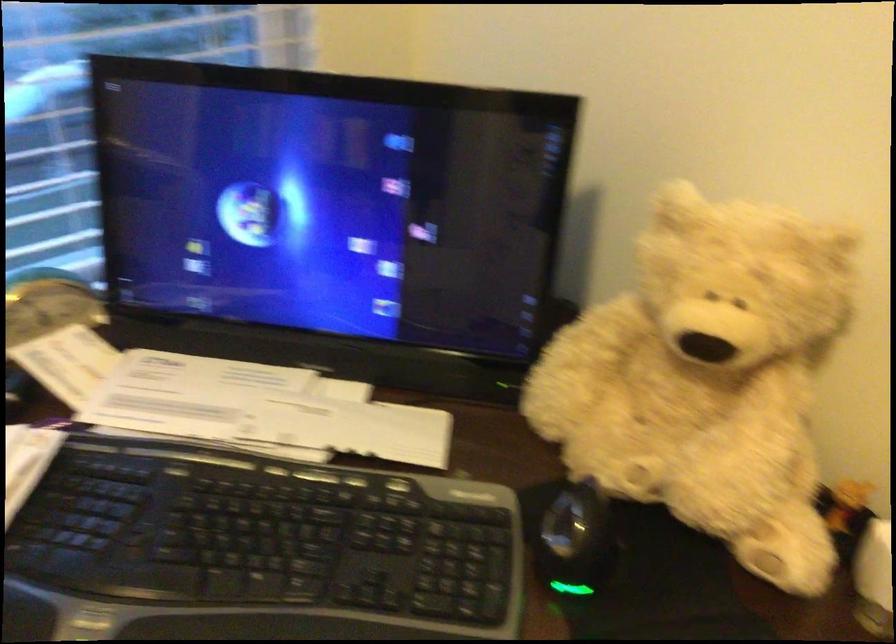
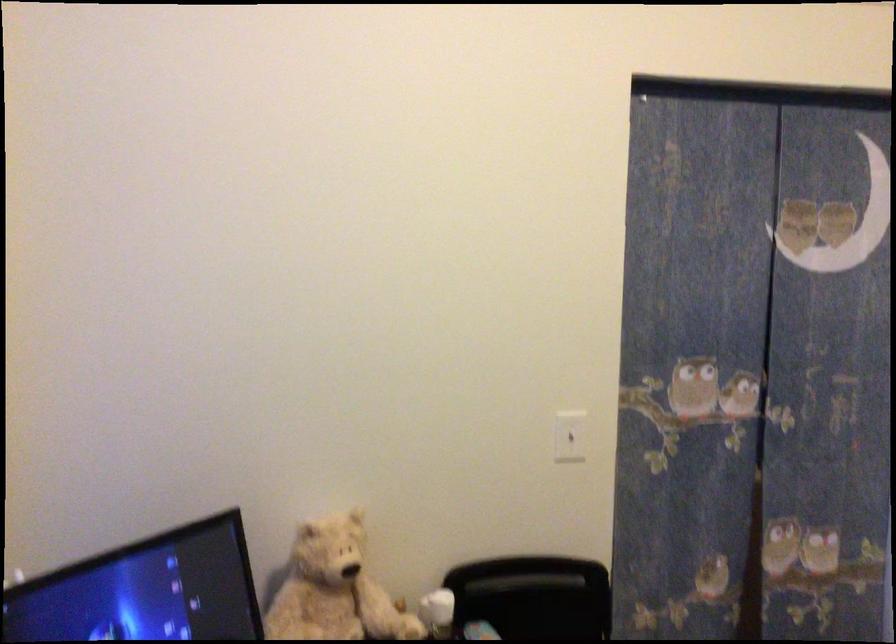
Locate, in the second image, the point that corresponds to pixel 711 361 in the first image.

(334, 589)